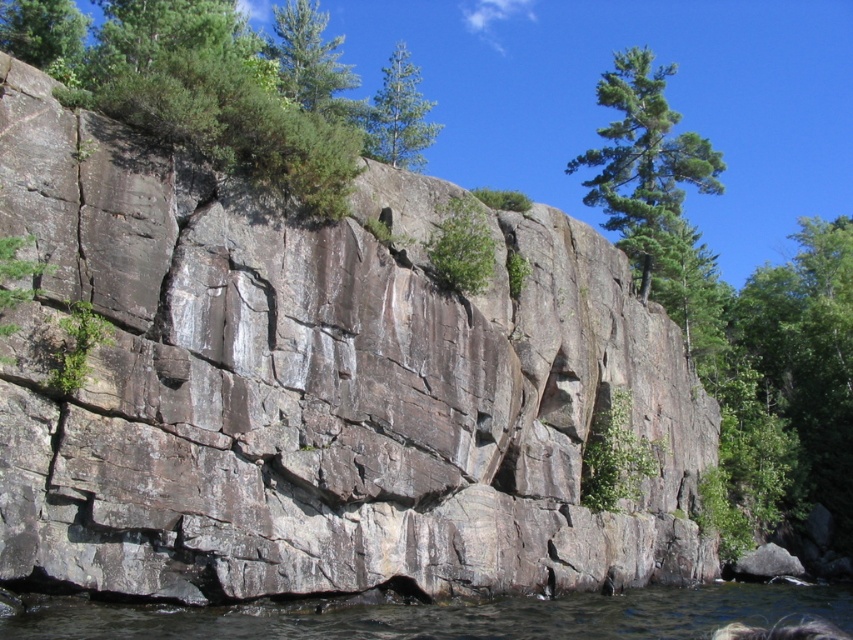
Question: Among these points, which one is farthest from the camera?

Choices:
 (A) (483, 276)
 (B) (384, 124)
 (C) (57, 44)

Answer: (B)

Question: Based on their relative distances, which object is farther from the green matte tree at center?

Choices:
 (A) green textured tree at upper right
 (B) green matte tree at upper center

Answer: (A)

Question: Which of the following is the farthest from the observer?

Choices:
 (A) 402,45
 (B) 42,52
 (C) 469,266

Answer: (A)

Question: Does green matte tree at upper center come in front of green matte tree at center?

Choices:
 (A) no
 (B) yes

Answer: (B)

Question: Does green textured tree at upper right appear under green matte tree at upper center?

Choices:
 (A) yes
 (B) no

Answer: (A)

Question: Can you confirm if clear water at lower center is thinner than green matte tree at upper center?

Choices:
 (A) no
 (B) yes

Answer: (A)